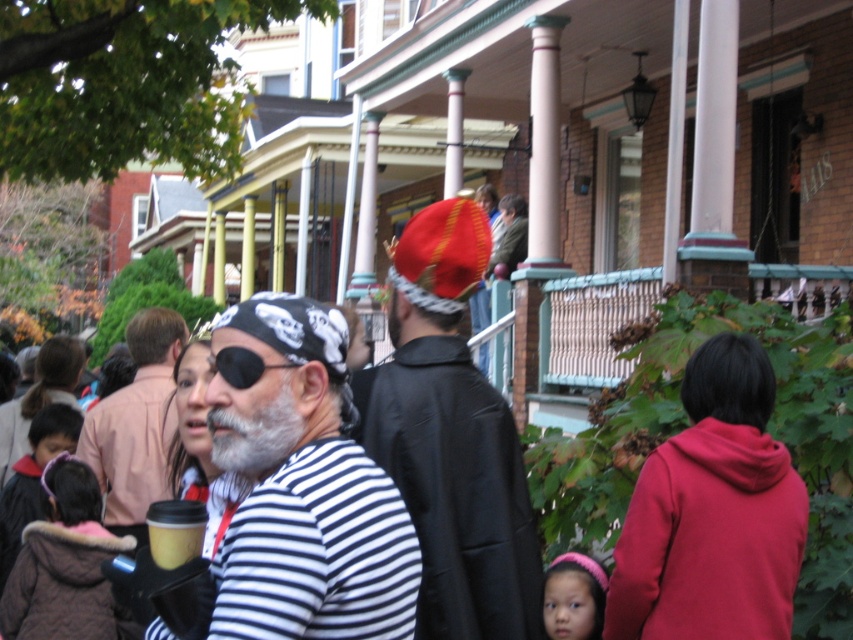
You are a photographer trying to capture both the whitewoolbeard at center and the pink fuzzy headband at lower right in the same frame. Which object should you focus on first to ensure both are in focus?

You should focus on the whitewoolbeard at center first because it is closer to the viewer than the pink fuzzy headband at lower right, so focusing on the closer object will help keep both in focus.

You are at a community event and see two accessories in the image. The first is a whitewoolbeard at center and the second is a pink fuzzy headband at lower right. Which accessory is positioned higher in the image?

The whitewoolbeard at center is positioned higher than the pink fuzzy headband at lower right.

You are standing at the origin of a coordinate system in this scene. There are two points marked in the image. The first point is at coordinates point (170, 422) and the second point is at point (209, 385). Which point is closer to you?

Point (209, 385) is closer to you because it is in front of point (170, 422) according to the spatial relationship provided.